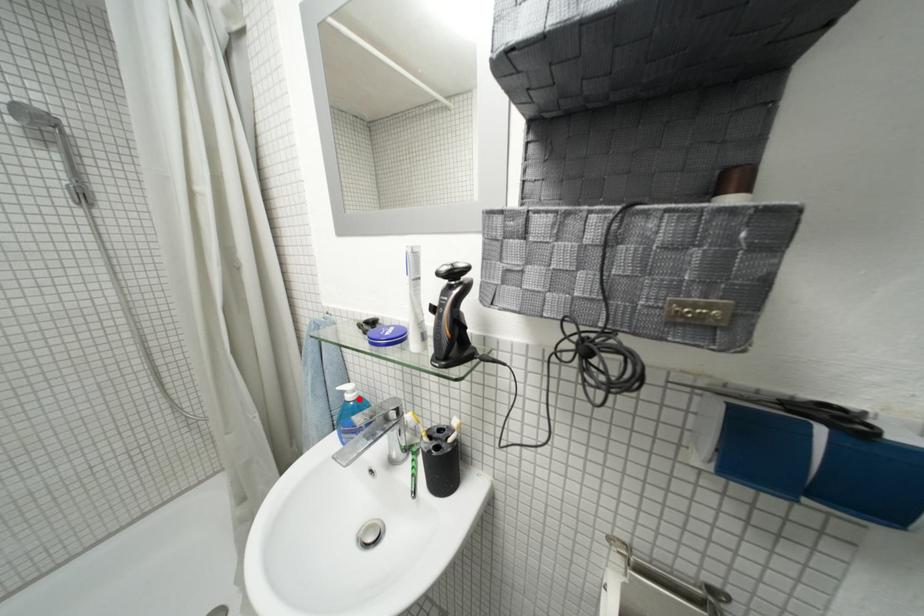
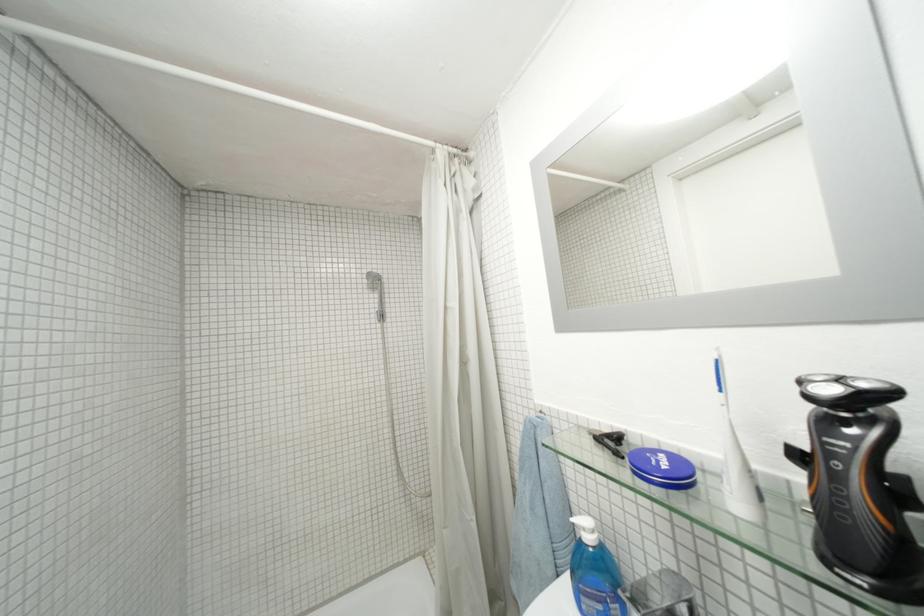
In the second image, find the point that corresponds to the highlighted location in the first image.

(598, 541)